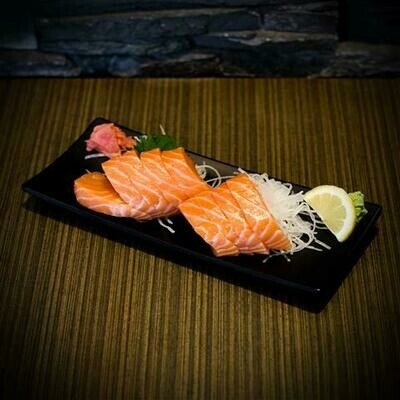
I want to click on platter, so click(151, 238).